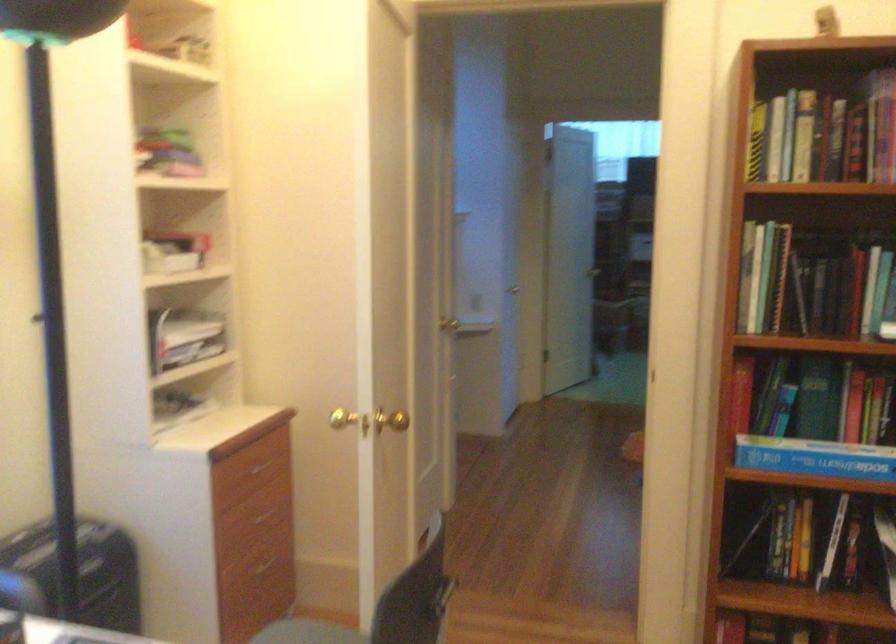
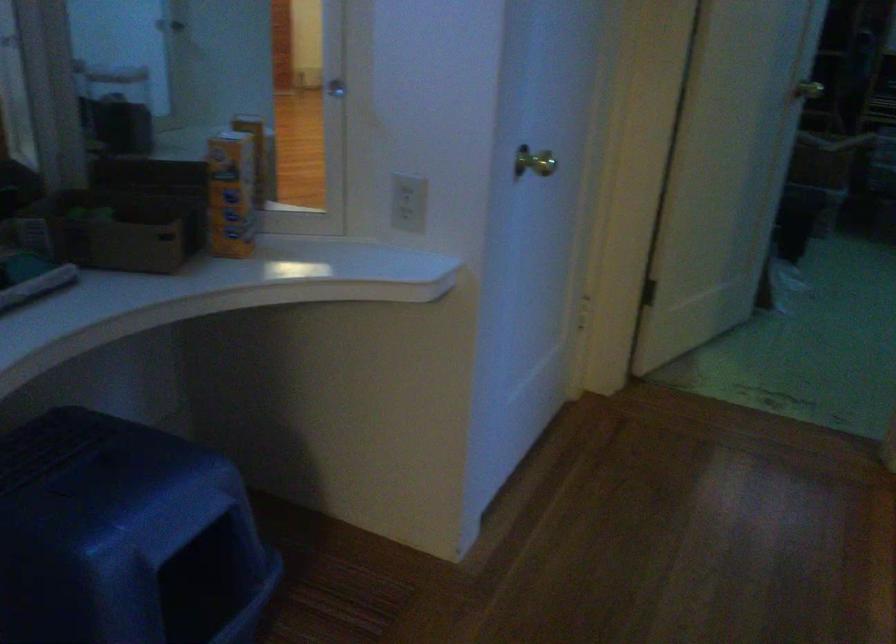
Question: In a continuous first-person perspective shot, in which direction is the camera moving?

Choices:
 (A) Left
 (B) Right
 (C) Forward
 (D) Backward

Answer: (C)